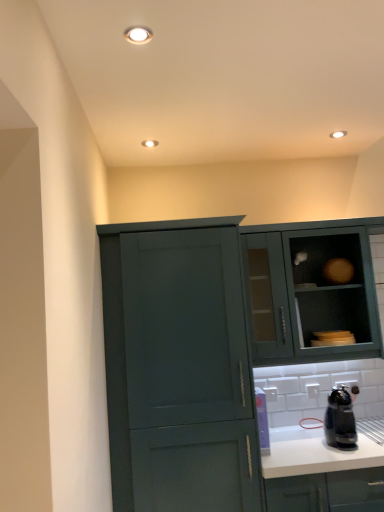
Question: Can you confirm if matte teal cabinet at center-left, which is the second cabinetry from right to left, is wider than black plastic coffee maker at lower right?

Choices:
 (A) no
 (B) yes

Answer: (B)

Question: Considering the relative positions of matte teal cabinet at center-left, arranged as the 1th cabinetry when viewed from the left, and black plastic coffee maker at lower right in the image provided, is matte teal cabinet at center-left, arranged as the 1th cabinetry when viewed from the left, to the left of black plastic coffee maker at lower right from the viewer's perspective?

Choices:
 (A) no
 (B) yes

Answer: (B)

Question: Is matte teal cabinet at center-left, which is the second cabinetry from right to left, not within black plastic coffee maker at lower right?

Choices:
 (A) yes
 (B) no

Answer: (A)

Question: Does matte teal cabinet at center-left, which is the second cabinetry from right to left, have a lesser height compared to black plastic coffee maker at lower right?

Choices:
 (A) no
 (B) yes

Answer: (A)

Question: Does matte teal cabinet at center-left, arranged as the 1th cabinetry when viewed from the left, have a greater height compared to black plastic coffee maker at lower right?

Choices:
 (A) yes
 (B) no

Answer: (A)

Question: Which is correct: white matte countertop at lower right is inside matte teal cabinet at center-left, which is the second cabinetry from right to left, or outside of it?

Choices:
 (A) inside
 (B) outside

Answer: (B)

Question: Is white matte countertop at lower right wider or thinner than matte teal cabinet at center-left, arranged as the 1th cabinetry when viewed from the left?

Choices:
 (A) thin
 (B) wide

Answer: (B)

Question: In terms of height, does white matte countertop at lower right look taller or shorter compared to matte teal cabinet at center-left, which is the second cabinetry from right to left?

Choices:
 (A) short
 (B) tall

Answer: (A)

Question: Looking at the image, does white matte countertop at lower right seem bigger or smaller compared to matte teal cabinet at center-left, arranged as the 1th cabinetry when viewed from the left?

Choices:
 (A) big
 (B) small

Answer: (B)

Question: Looking at the image, does black plastic coffee maker at lower right seem bigger or smaller compared to matte teal cabinet at upper right, arranged as the 1th cabinetry when viewed from the right?

Choices:
 (A) small
 (B) big

Answer: (A)

Question: Is black plastic coffee maker at lower right inside or outside of matte teal cabinet at upper right, the second cabinetry positioned from the left?

Choices:
 (A) outside
 (B) inside

Answer: (A)

Question: In terms of width, does black plastic coffee maker at lower right look wider or thinner when compared to matte teal cabinet at upper right, arranged as the 1th cabinetry when viewed from the right?

Choices:
 (A) thin
 (B) wide

Answer: (A)

Question: Considering the positions of black plastic coffee maker at lower right and matte teal cabinet at upper right, the second cabinetry positioned from the left, in the image, is black plastic coffee maker at lower right taller or shorter than matte teal cabinet at upper right, the second cabinetry positioned from the left,?

Choices:
 (A) tall
 (B) short

Answer: (B)

Question: Is matte teal cabinet at center-left, which is the second cabinetry from right to left, wider or thinner than matte teal cabinet at upper right, arranged as the 1th cabinetry when viewed from the right?

Choices:
 (A) thin
 (B) wide

Answer: (B)

Question: From a real-world perspective, relative to matte teal cabinet at upper right, the second cabinetry positioned from the left, is matte teal cabinet at center-left, which is the second cabinetry from right to left, vertically above or below?

Choices:
 (A) above
 (B) below

Answer: (B)